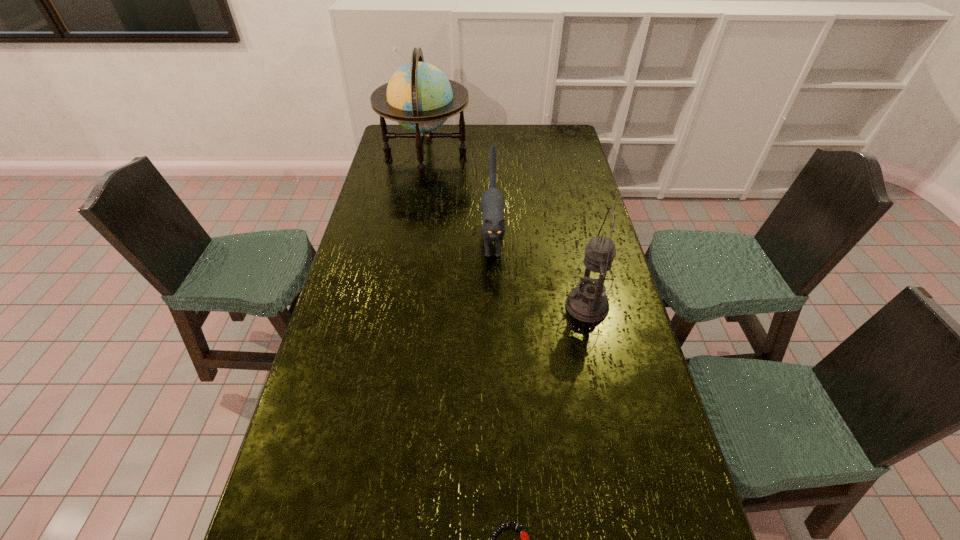
Find the location of a particular element. The width and height of the screenshot is (960, 540). object present at the left edge is located at coordinates (419, 96).

The width and height of the screenshot is (960, 540). Identify the location of object at the right edge. (588, 302).

This screenshot has height=540, width=960. I want to click on object present at the far left corner, so [419, 96].

In order to click on free space at the far edge in this screenshot , I will do `click(481, 131)`.

Where is `vacant region at the left edge`? The image size is (960, 540). vacant region at the left edge is located at coordinates (405, 187).

You are a GUI agent. You are given a task and a screenshot of the screen. Output one action in this format:
    pyautogui.click(x=<x>, y=<y>)
    Task: Click on the vacant space at the right edge of the desktop
    The width and height of the screenshot is (960, 540).
    Given the screenshot: What is the action you would take?
    pyautogui.click(x=580, y=230)

Where is `free region at the far left corner of the desktop`? The height and width of the screenshot is (540, 960). free region at the far left corner of the desktop is located at coordinates (415, 146).

Locate an element on the screen. The width and height of the screenshot is (960, 540). blank region between the rightmost object and the second shortest object is located at coordinates (540, 272).

Locate an element on the screen. The height and width of the screenshot is (540, 960). vacant area that lies between the second nearest object and the farthest object is located at coordinates (506, 230).

Locate an element on the screen. The height and width of the screenshot is (540, 960). free point between the tallest object and the second shortest object is located at coordinates (459, 197).